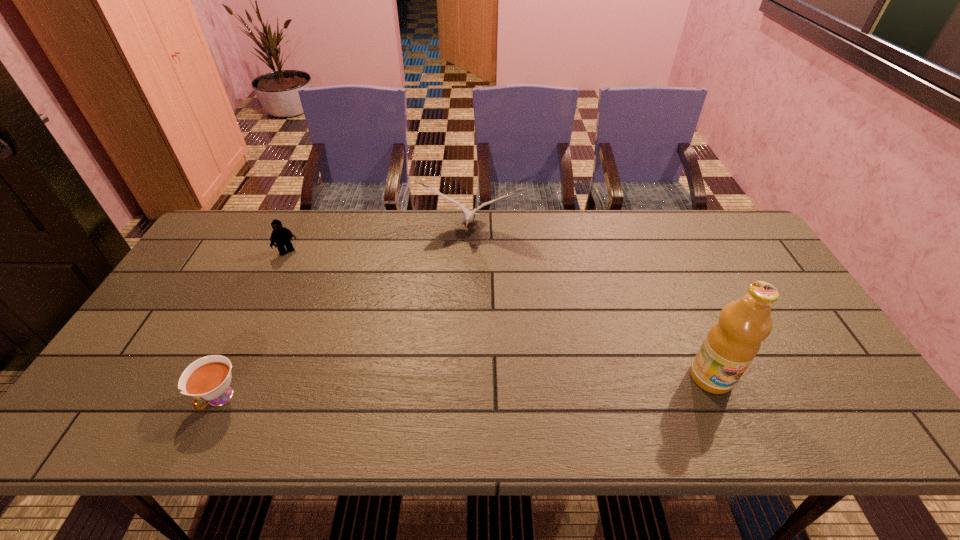
Where is `the shortest object`? The width and height of the screenshot is (960, 540). the shortest object is located at coordinates (208, 378).

This screenshot has height=540, width=960. In order to click on olive oil in this screenshot , I will do `click(731, 344)`.

Where is `the tallest object`? This screenshot has width=960, height=540. the tallest object is located at coordinates (731, 344).

This screenshot has width=960, height=540. I want to click on the second tallest object, so click(x=469, y=216).

Find the location of `gull`. gull is located at coordinates (469, 216).

The image size is (960, 540). In order to click on the second shortest object in this screenshot , I will do `click(280, 235)`.

The image size is (960, 540). I want to click on vacant area situated at the tip of the beak of the second tallest object, so click(x=457, y=268).

Where is `vacant space located 0.070m at the tip of the beak of the second tallest object`? vacant space located 0.070m at the tip of the beak of the second tallest object is located at coordinates (459, 259).

Identify the location of vacant space located 0.090m at the tip of the beak of the second tallest object. This screenshot has width=960, height=540. (458, 264).

The height and width of the screenshot is (540, 960). In order to click on vacant space located on the face of the third tallest object in this screenshot , I will do `click(315, 284)`.